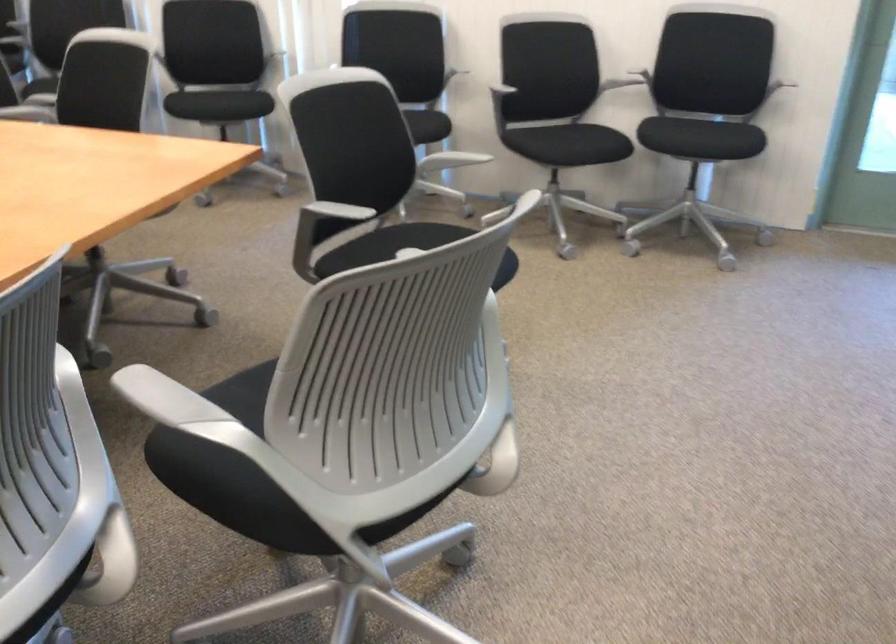
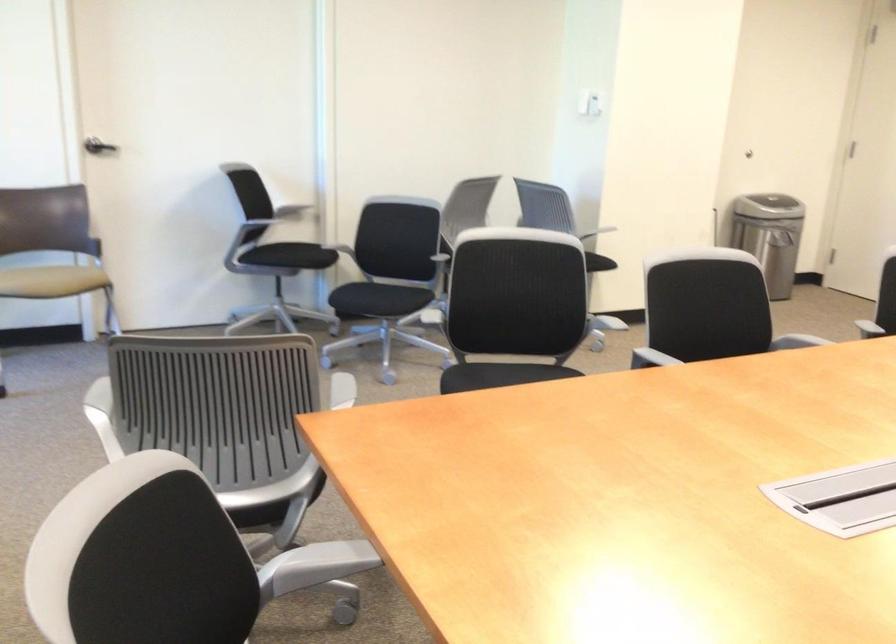
Locate, in the second image, the point that corresponds to pixel 99 138 in the first image.

(320, 562)